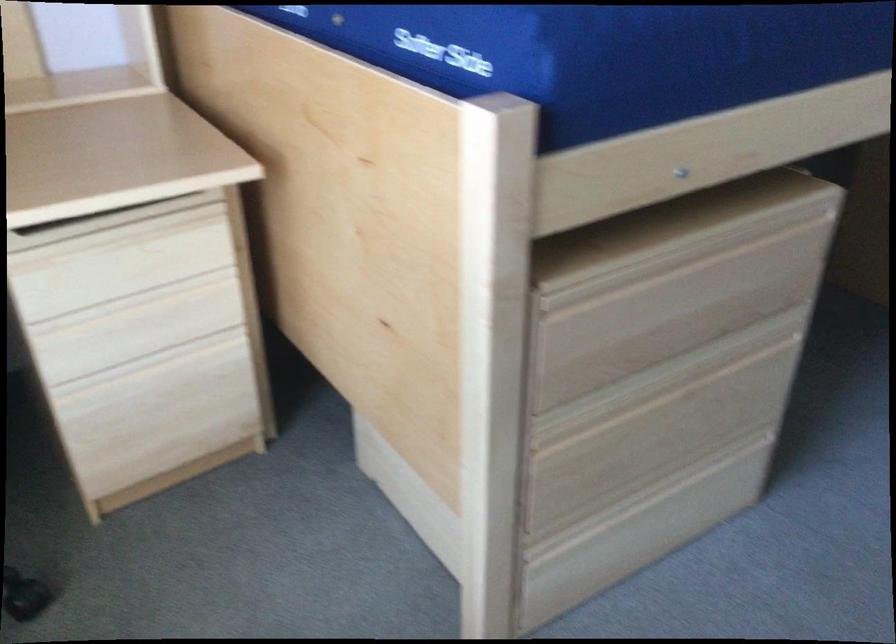
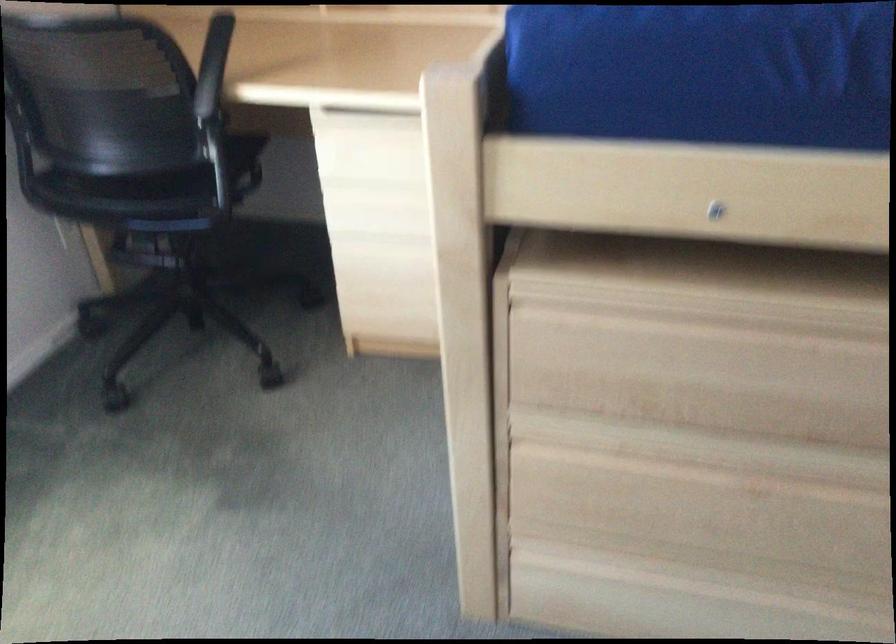
The point at (657, 375) is marked in the first image. Where is the corresponding point in the second image?

(716, 451)